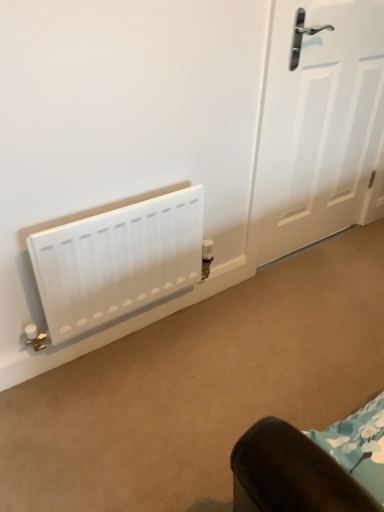
Question: Considering the positions of point (130, 246) and point (354, 106), is point (130, 246) closer or farther from the camera than point (354, 106)?

Choices:
 (A) closer
 (B) farther

Answer: (A)

Question: Choose the correct answer: Is white matte radiator at lower left inside white matte door at right or outside it?

Choices:
 (A) inside
 (B) outside

Answer: (B)

Question: Considering their positions, is white matte radiator at lower left located in front of or behind white matte door at right?

Choices:
 (A) front
 (B) behind

Answer: (A)

Question: From a real-world perspective, is white matte door at right positioned above or below white matte radiator at lower left?

Choices:
 (A) below
 (B) above

Answer: (B)

Question: Is point (367, 166) closer or farther from the camera than point (51, 233)?

Choices:
 (A) farther
 (B) closer

Answer: (A)

Question: Is white matte door at right wider or thinner than white matte radiator at lower left?

Choices:
 (A) thin
 (B) wide

Answer: (A)

Question: In terms of size, does white matte door at right appear bigger or smaller than white matte radiator at lower left?

Choices:
 (A) small
 (B) big

Answer: (B)